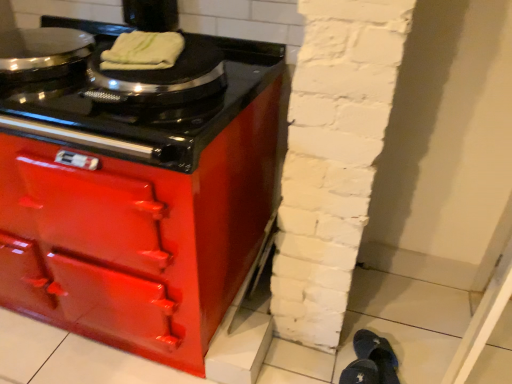
What do you see at coordinates (149, 108) in the screenshot?
I see `glossy black cooktop at upper left` at bounding box center [149, 108].

Locate an element on the screen. glossy black cooktop at upper left is located at coordinates (149, 108).

Locate an element on the screen. The image size is (512, 384). glossy black cooktop at upper left is located at coordinates (149, 108).